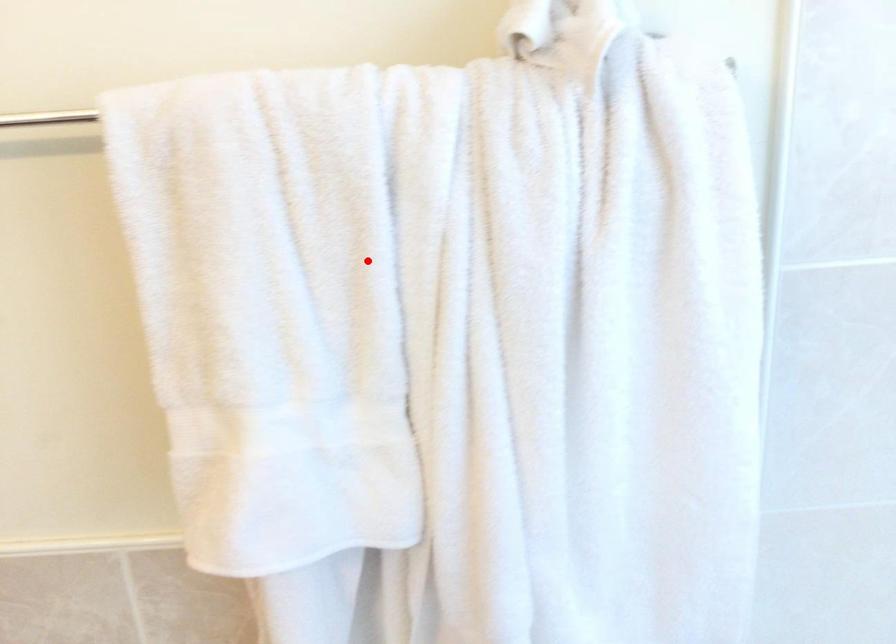
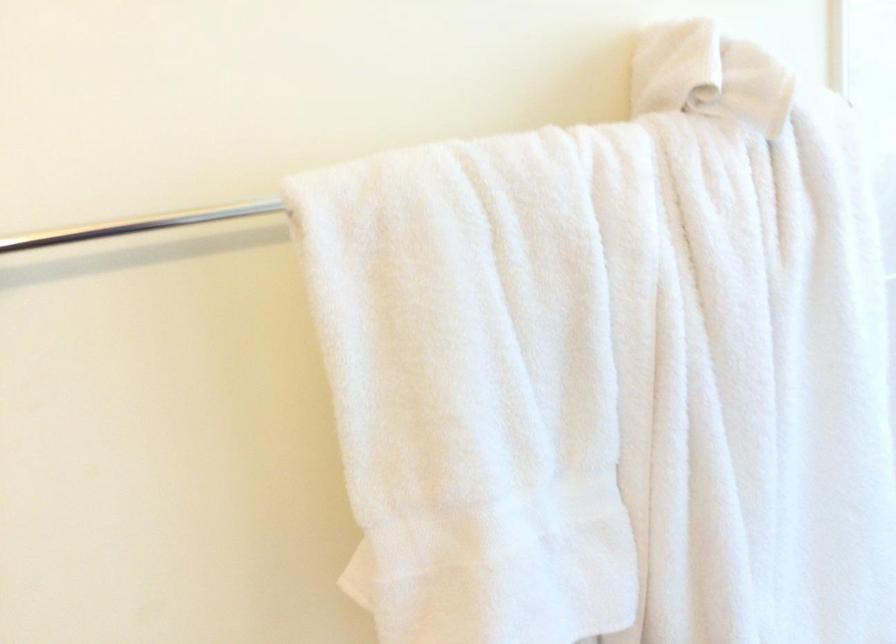
Find the pixel in the second image that matches the highlighted location in the first image.

(607, 344)